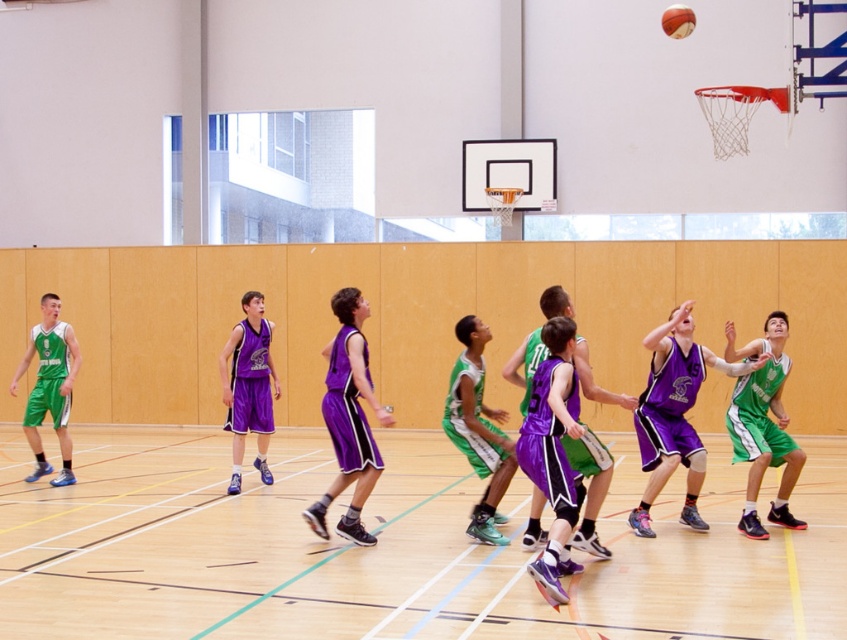
You are a sports analyst watching the game. You see the green matte basketball player at center and the purple matte basketball uniform at center. Which one appears smaller in size?

The green matte basketball player at center has a smaller size compared to the purple matte basketball uniform at center.

You are a photographer positioned at the side of the court. You want to take a photo of both the green jersey at center and the purple matte basketball uniform at center. Which one will appear larger in your photo?

The green jersey at center will appear larger in the photo because it is closer to the viewer than the purple matte basketball uniform at center.

In the basketball game scene, there is a point marked at coordinates (479, 429). Which player is this point located on?

The point marked at coordinates (479, 429) is located on the green matte basketball player at center.